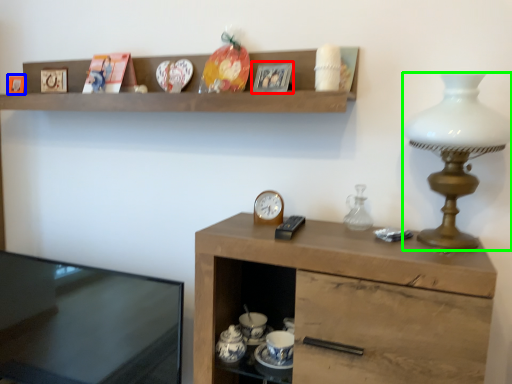
Question: Estimate the real-world distances between objects in this image. Which object is closer to picture frame (highlighted by a red box), picture frame (highlighted by a blue box) or lamp (highlighted by a green box)?

Choices:
 (A) picture frame
 (B) lamp

Answer: (B)